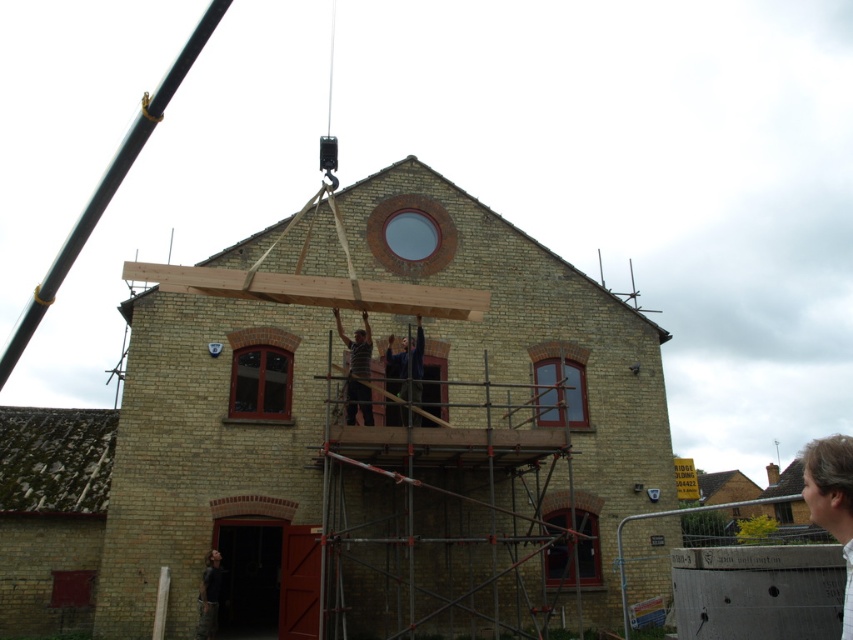
You are a construction worker standing at the entrance of the building. You need to check the condition of the rusty metal roof at lower left and the clear glass window at center. Which object is closer to your current position?

The rusty metal roof at lower left is closer to your current position because it is to the left of the clear glass window at center, which would place it nearer to the entrance where you are standing.

You are a worker standing at the entrance of the brick building. You need to reach two points marked on your blueprint. One is at point (90, 468) and the other at point (405, 209). Which point should you head to first if you want to reach the one closer to you first?

You should head to point (90, 468) first because it is closer to you than point (405, 209).

You are a construction worker standing in front of the building. You need to move a heavy tool that requires a space larger than the clear glass window at center. Can you place it on the wooden beam at center?

The wooden beam at center is bigger than the clear glass window at center, so yes, the heavy tool can be placed on the wooden beam at center since it has sufficient space.